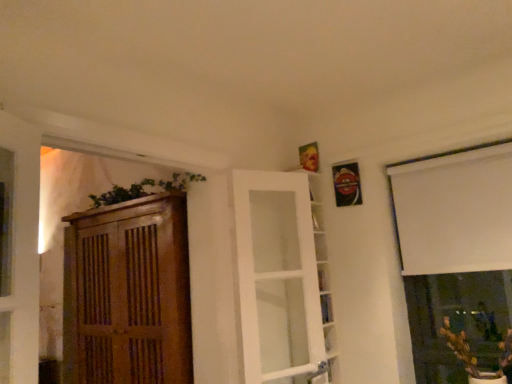
Question: Relative to white matte window at upper right, is green matte plant at lower right in front or behind?

Choices:
 (A) behind
 (B) front

Answer: (B)

Question: Looking at the image, does green matte plant at lower right seem bigger or smaller compared to white matte window at upper right?

Choices:
 (A) big
 (B) small

Answer: (B)

Question: Which of these objects is positioned closest to the green leafy plant at upper left?

Choices:
 (A) green matte plant at lower right
 (B) wooden cabinet at left
 (C) white matte window at upper right
 (D) white glass door at center

Answer: (B)

Question: Which object is the farthest from the green matte plant at lower right?

Choices:
 (A) green leafy plant at upper left
 (B) white matte window at upper right
 (C) wooden cabinet at left
 (D) white glass door at center

Answer: (C)